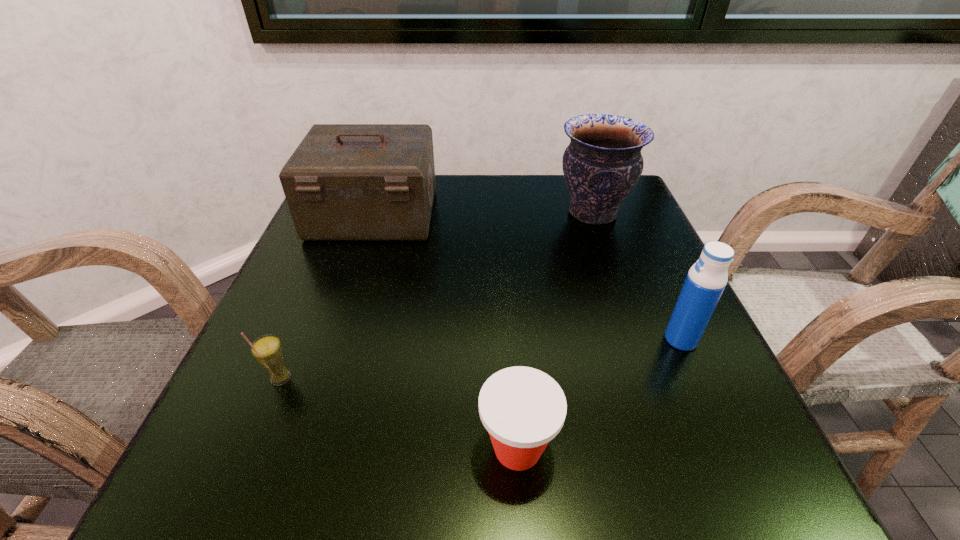
The image size is (960, 540). I want to click on blank region between the nearest object and the first-aid kit, so click(x=445, y=331).

What are the coordinates of `empty space between the third object from right to left and the straw for drinking` in the screenshot? It's located at (399, 413).

Locate an element on the screen. The image size is (960, 540). vacant point located between the Dixie cup and the second nearest object is located at coordinates (399, 413).

Find the location of a particular element. vacant space in between the fourth farthest object and the nearest object is located at coordinates (399, 413).

Find the location of a particular element. Image resolution: width=960 pixels, height=540 pixels. vacant space in between the pottery and the third nearest object is located at coordinates (636, 276).

I want to click on vacant area that lies between the first-aid kit and the straw for drinking, so click(327, 296).

Locate an element on the screen. vacant region between the first-aid kit and the Dixie cup is located at coordinates (445, 331).

This screenshot has height=540, width=960. Identify the location of unoccupied area between the water bottle and the first-aid kit. (527, 277).

Locate an element on the screen. the fourth closest object to the fourth farthest object is located at coordinates (706, 280).

Where is `object identified as the fourth closest to the third farthest object`? object identified as the fourth closest to the third farthest object is located at coordinates (267, 350).